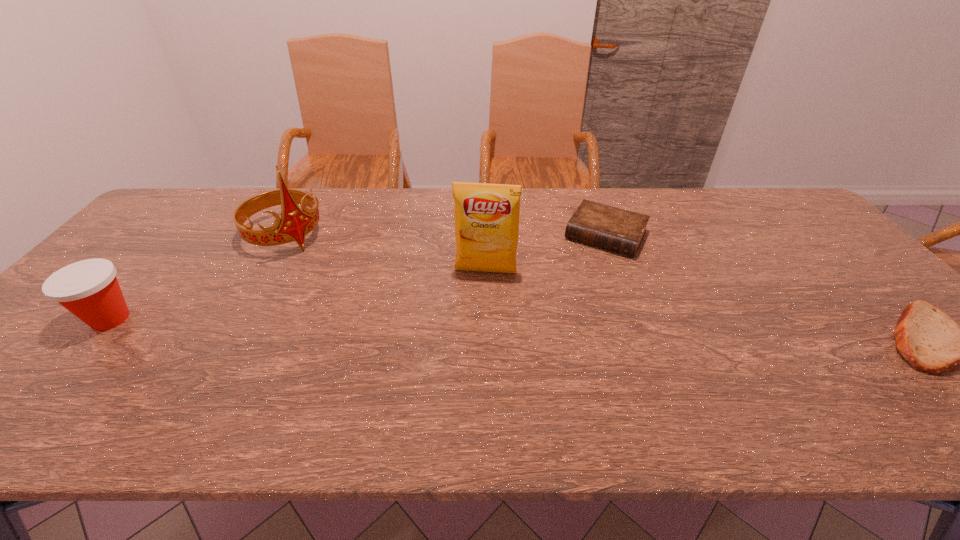
This screenshot has height=540, width=960. I want to click on Dixie cup, so click(x=89, y=289).

Locate an element on the screen. This screenshot has width=960, height=540. the leftmost object is located at coordinates (89, 289).

Where is `the fourth object from left to right`? The width and height of the screenshot is (960, 540). the fourth object from left to right is located at coordinates (611, 228).

Find the location of a particular element. diary is located at coordinates (611, 228).

What are the coordinates of `crisp (potato chip)` in the screenshot? It's located at (486, 215).

You are a GUI agent. You are given a task and a screenshot of the screen. Output one action in this format:
    pyautogui.click(x=<x>, y=<y>)
    Task: Click on the third nearest object
    
    Given the screenshot: What is the action you would take?
    pyautogui.click(x=486, y=215)

Locate an element on the screen. The height and width of the screenshot is (540, 960). the second object from left to right is located at coordinates pyautogui.click(x=294, y=224).

The width and height of the screenshot is (960, 540). In order to click on free space located on the back of the leftmost object in this screenshot , I will do [x=142, y=282].

Locate an element on the screen. The height and width of the screenshot is (540, 960). vacant region located on the spine side of the second shortest object is located at coordinates (586, 269).

At what (x,y) coordinates should I click in order to perform the action: click on free space located 0.110m on the spine side of the second shortest object. Please return your answer as a coordinate pair (x, y). This screenshot has height=540, width=960. Looking at the image, I should click on (579, 279).